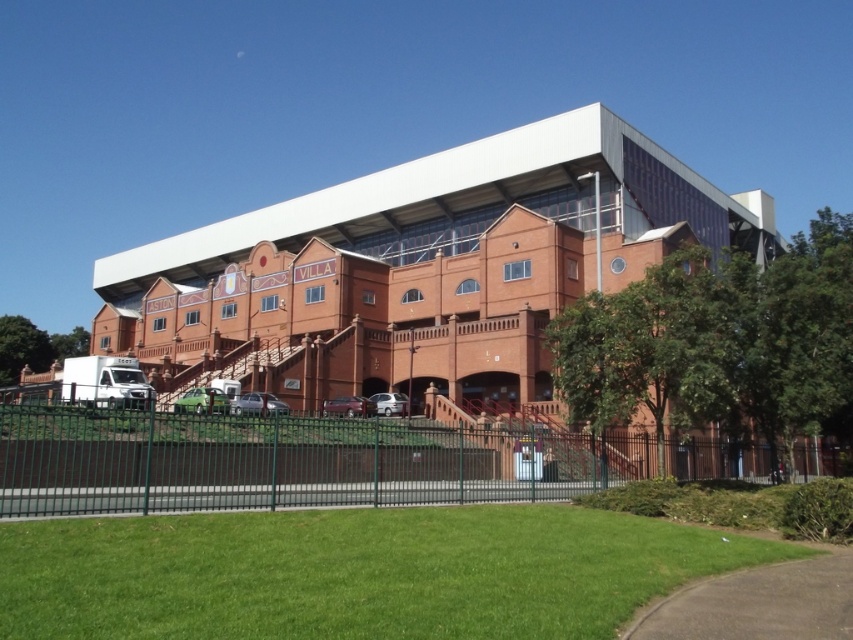
You are a groundskeeper tasked with mowing the lawn. You see the green grass at lower center and the green metal fence at lower center. Which area requires more time to maintain if the fence needs cleaning and the grass needs trimming?

The green metal fence at lower center requires more time to maintain because it occupies more space than the green grass at lower center according to the description.

You are standing at the entrance of the building and want to reach the green grass at lower center marked by point (355,572). The fence in front of you has a gate located at point 0.5. Can you walk straight ahead to reach the green grass at lower center?

Yes, you can walk straight ahead because the green grass at lower center is located at point (355,572), which is in the lower center area beyond the fence. Since the gate is at point 0.5, walking straight through the gate would lead you towards the green grass at lower center.

You are a groundskeeper at the sports complex and need to mow the lawn. You see the green grass at lower center and the green metal fence at lower center. Which one is shorter?

The green grass at lower center is shorter than the green metal fence at lower center because it is not as tall as the fence.